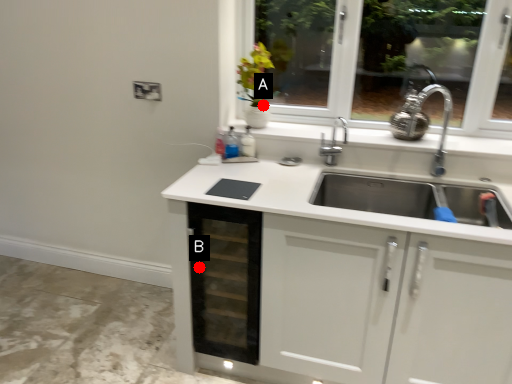
Question: Two points are circled on the image, labeled by A and B beside each circle. Which of the following is the farthest from the observer?

Choices:
 (A) A is further
 (B) B is further

Answer: (A)